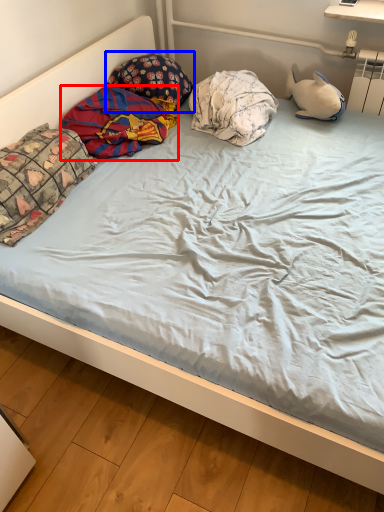
Question: Which of the following is the closest to the observer, material (highlighted by a red box) or pillow (highlighted by a blue box)?

Choices:
 (A) material
 (B) pillow

Answer: (A)